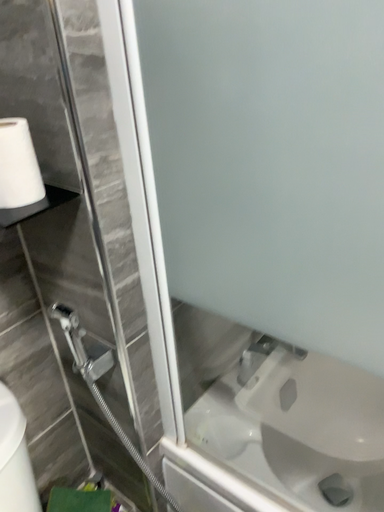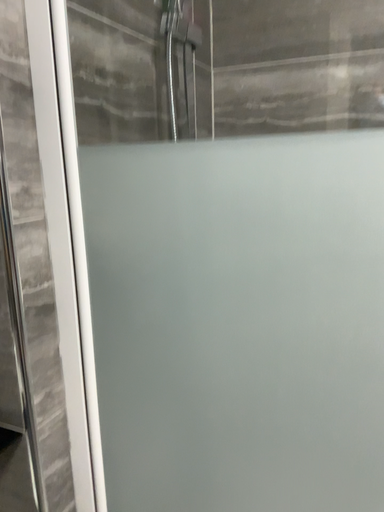
Question: How did the camera likely rotate when shooting the video?

Choices:
 (A) rotated left
 (B) rotated right

Answer: (B)